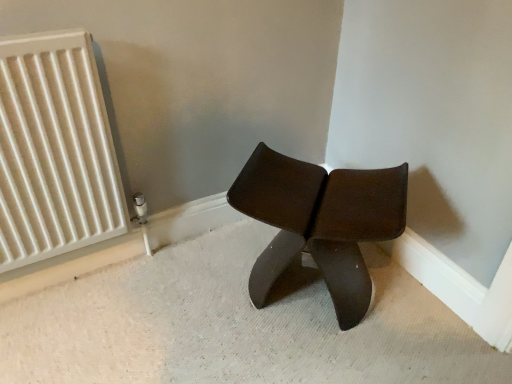
Find the location of a particular element. The image size is (512, 384). vacant space in white matte radiator at left (from a real-world perspective) is located at coordinates (86, 274).